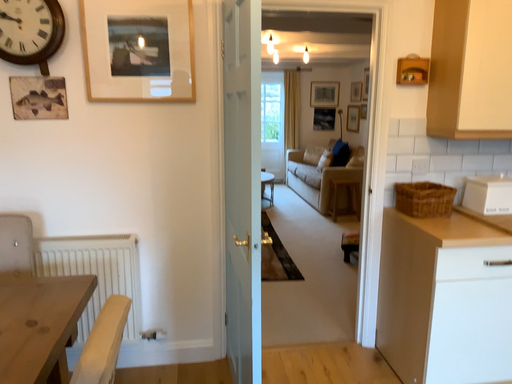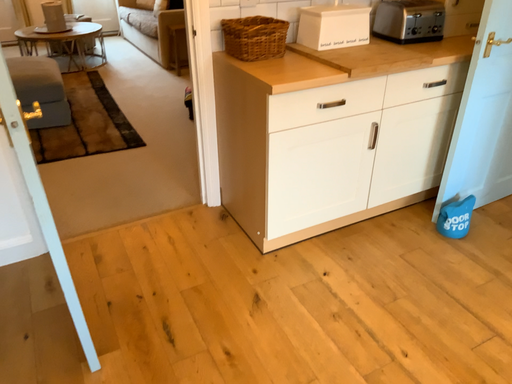
Question: Which way did the camera rotate in the video?

Choices:
 (A) rotated right
 (B) rotated left

Answer: (A)